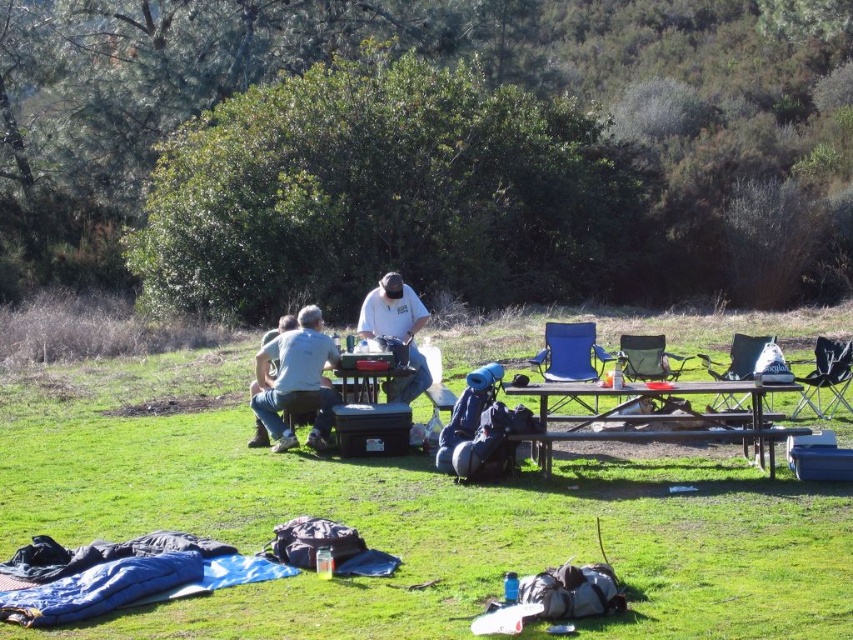
This screenshot has height=640, width=853. What do you see at coordinates (570, 353) in the screenshot? I see `blue fabric chair at center` at bounding box center [570, 353].

Does blue fabric chair at center have a lesser width compared to green fabric chair at center?

No, blue fabric chair at center is not thinner than green fabric chair at center.

Where is `blue fabric chair at center`? The height and width of the screenshot is (640, 853). blue fabric chair at center is located at coordinates (570, 353).

The image size is (853, 640). What are the coordinates of `blue fabric chair at center` in the screenshot? It's located at (570, 353).

Is green fabric folding chair at center right above green fabric chair at center?

Actually, green fabric folding chair at center right is below green fabric chair at center.

Who is positioned more to the right, green fabric folding chair at center right or green fabric chair at center?

From the viewer's perspective, green fabric folding chair at center right appears more on the right side.

Locate an element on the screen. green fabric folding chair at center right is located at coordinates (827, 376).

Who is lower down, green fabric chair at center or green fabric chair at right?

green fabric chair at right is lower down.

Identify the location of green fabric chair at center. (647, 356).

Where is `green fabric chair at center`? The image size is (853, 640). green fabric chair at center is located at coordinates (647, 356).